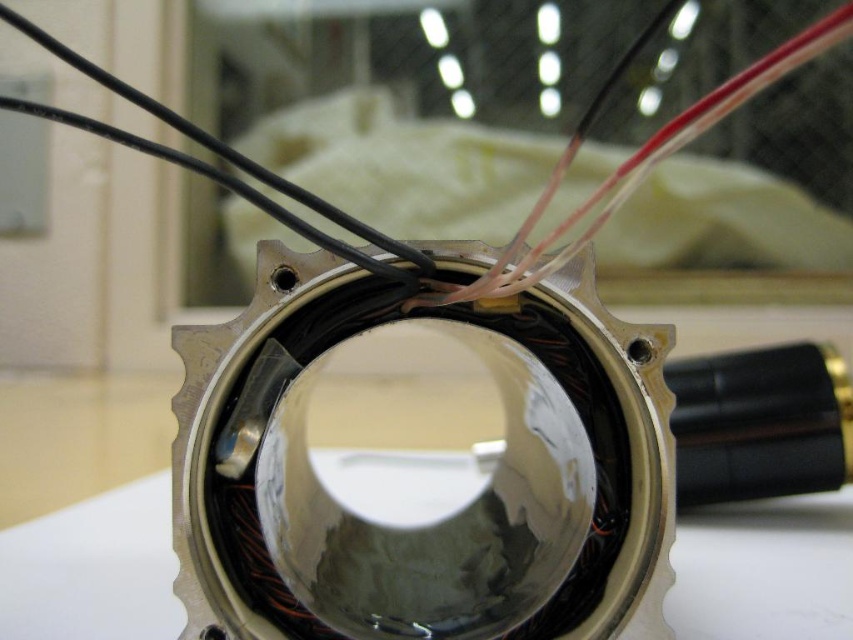
Question: Observing the image, what is the correct spatial positioning of shiny metallic lens at center in reference to black wire at center?

Choices:
 (A) above
 (B) below

Answer: (B)

Question: Can you confirm if shiny metallic lens at center is positioned above black wire at center?

Choices:
 (A) yes
 (B) no

Answer: (B)

Question: In this image, where is shiny metallic lens at center located relative to black wire at center?

Choices:
 (A) below
 (B) above

Answer: (A)

Question: Which object is closer to the camera taking this photo?

Choices:
 (A) black wire at center
 (B) shiny metallic lens at center

Answer: (A)

Question: Which point is closer to the camera?

Choices:
 (A) (49, 48)
 (B) (486, 516)

Answer: (A)